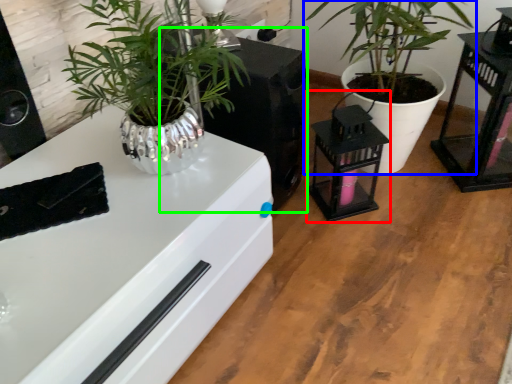
Question: Based on their relative distances, which object is farther from appliance (highlighted by a red box)? Choose from houseplant (highlighted by a blue box) and appliance (highlighted by a green box).

Choices:
 (A) houseplant
 (B) appliance

Answer: (A)